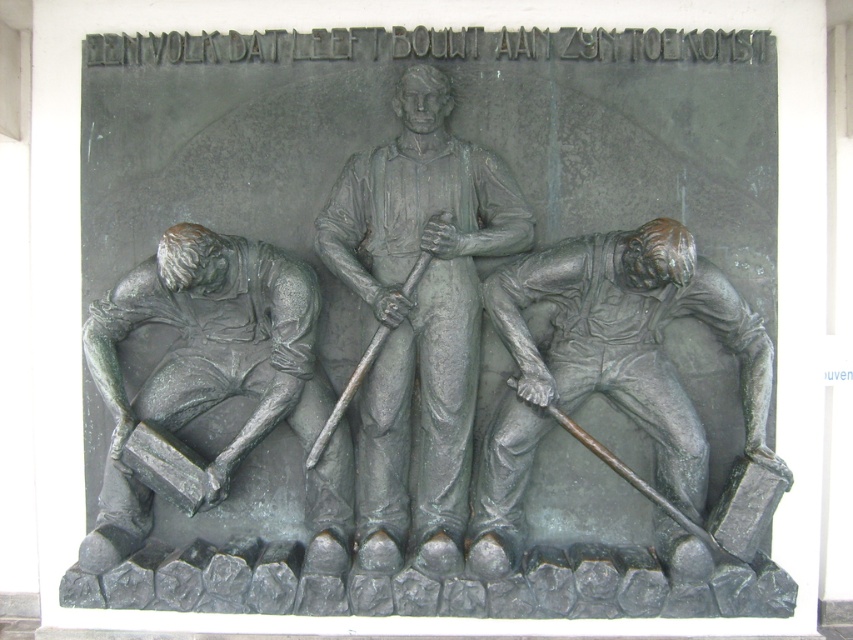
Question: Can you confirm if bronze statue at center is positioned below bronze figure at lower left?

Choices:
 (A) yes
 (B) no

Answer: (B)

Question: Among these objects, which one is farthest from the camera?

Choices:
 (A) bronze statue at center
 (B) bronze figure at lower right
 (C) bronze figure at lower left

Answer: (A)

Question: Does bronze statue at center have a larger size compared to bronze figure at lower left?

Choices:
 (A) yes
 (B) no

Answer: (B)

Question: Which of these objects is positioned farthest from the bronze statue at center?

Choices:
 (A) bronze figure at lower right
 (B) bronze figure at lower left

Answer: (B)

Question: Where is bronze statue at center located in relation to bronze figure at lower right in the image?

Choices:
 (A) below
 (B) above

Answer: (B)

Question: Which point is closer to the camera?

Choices:
 (A) (x=357, y=237)
 (B) (x=590, y=276)

Answer: (B)